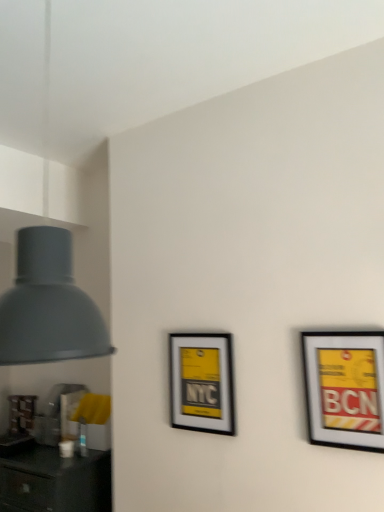
Measure the distance between matte gray lampshade at left and camera.

The distance of matte gray lampshade at left from camera is 27.06 inches.

Where is `matte black picture frame at right, which is the first picture frame in right-to-left order`? Image resolution: width=384 pixels, height=512 pixels. matte black picture frame at right, which is the first picture frame in right-to-left order is located at coordinates (345, 388).

Identify the location of matte black picture frame at center, which ranks as the first picture frame in back-to-front order. This screenshot has width=384, height=512. (202, 382).

Does matte black picture frame at center, the second picture frame positioned from the right, have a smaller size compared to matte gray lampshade at left?

Correct, matte black picture frame at center, the second picture frame positioned from the right, occupies less space than matte gray lampshade at left.

Is matte black picture frame at center, which ranks as the first picture frame in back-to-front order, oriented towards matte gray lampshade at left?

Yes, matte black picture frame at center, which ranks as the first picture frame in back-to-front order, is oriented towards matte gray lampshade at left.

Is there a large distance between matte black picture frame at center, which ranks as the 1th picture frame in left-to-right order, and matte gray lampshade at left?

Yes.

Is matte black picture frame at center, which ranks as the first picture frame in back-to-front order, inside or outside of matte gray lampshade at left?

matte black picture frame at center, which ranks as the first picture frame in back-to-front order, is not inside matte gray lampshade at left, it's outside.

Would you say matte black picture frame at center, which ranks as the 1th picture frame in left-to-right order, is inside or outside matte black picture frame at right, the 2th picture frame in the left-to-right sequence?

The correct answer is: outside.

Who is bigger, matte black picture frame at center, the second picture frame positioned from the right, or matte black picture frame at right, which is the first picture frame in right-to-left order?

With larger size is matte black picture frame at center, the second picture frame positioned from the right.

Which is behind, point (210, 387) or point (380, 406)?

Point (210, 387)

Could you measure the distance between matte black picture frame at right, which is the first picture frame in right-to-left order, and matte black picture frame at center, the second picture frame positioned from the right?

matte black picture frame at right, which is the first picture frame in right-to-left order, and matte black picture frame at center, the second picture frame positioned from the right, are 18.64 inches apart.

How many degrees apart are the facing directions of matte black picture frame at right, acting as the first picture frame starting from the front, and matte black picture frame at center, which ranks as the 1th picture frame in left-to-right order?

93 degrees.

Is matte black picture frame at right, acting as the first picture frame starting from the front, thinner than matte black picture frame at center, which ranks as the 1th picture frame in left-to-right order?

No.

Find the location of a particular element. The height and width of the screenshot is (512, 384). picture frame located above the matte black picture frame at right, acting as the second picture frame starting from the back (from a real-world perspective) is located at coordinates (202, 382).

Are matte gray lampshade at left and matte black picture frame at right, acting as the second picture frame starting from the back, far apart?

Absolutely, matte gray lampshade at left is distant from matte black picture frame at right, acting as the second picture frame starting from the back.

How many degrees apart are the facing directions of matte gray lampshade at left and matte black picture frame at right, acting as the second picture frame starting from the back?

The angular difference between matte gray lampshade at left and matte black picture frame at right, acting as the second picture frame starting from the back, is 59.4 degrees.

Does matte gray lampshade at left have a smaller size compared to matte black picture frame at right, acting as the second picture frame starting from the back?

Actually, matte gray lampshade at left might be larger than matte black picture frame at right, acting as the second picture frame starting from the back.

Is matte gray lampshade at left positioned before matte black picture frame at right, acting as the first picture frame starting from the front?

Yes.

Which point is more distant from viewer, (47, 13) or (221, 359)?

Point (221, 359)

Is matte gray lampshade at left smaller than matte black picture frame at center, the second picture frame positioned from the right?

Incorrect, matte gray lampshade at left is not smaller in size than matte black picture frame at center, the second picture frame positioned from the right.

Considering the positions of objects matte gray lampshade at left and matte black picture frame at center, which ranks as the 1th picture frame in left-to-right order, in the image provided, who is more to the right, matte gray lampshade at left or matte black picture frame at center, which ranks as the 1th picture frame in left-to-right order,?

matte black picture frame at center, which ranks as the 1th picture frame in left-to-right order, is more to the right.

From the image's perspective, who appears lower, matte gray lampshade at left or matte black picture frame at center, which ranks as the 1th picture frame in left-to-right order?

matte black picture frame at center, which ranks as the 1th picture frame in left-to-right order, from the image's perspective.

Which of these two, matte black picture frame at right, the 2th picture frame in the left-to-right sequence, or matte gray lampshade at left, stands taller?

Standing taller between the two is matte gray lampshade at left.

Can you confirm if matte black picture frame at right, acting as the first picture frame starting from the front, is bigger than matte gray lampshade at left?

No, matte black picture frame at right, acting as the first picture frame starting from the front, is not bigger than matte gray lampshade at left.

Can matte gray lampshade at left be found inside matte black picture frame at right, which is the first picture frame in right-to-left order?

No, matte gray lampshade at left is not a part of matte black picture frame at right, which is the first picture frame in right-to-left order.

Based on their positions, is matte black picture frame at right, acting as the first picture frame starting from the front, located to the left or right of matte gray lampshade at left?

In the image, matte black picture frame at right, acting as the first picture frame starting from the front, appears on the right side of matte gray lampshade at left.

Identify the location of picture frame that is the 2nd object located below the matte gray lampshade at left (from the image's perspective). (202, 382).

I want to click on picture frame that appears above the matte black picture frame at center, which ranks as the 1th picture frame in left-to-right order (from the image's perspective), so click(x=345, y=388).

Considering their positions, is matte black picture frame at center, which ranks as the 1th picture frame in left-to-right order, positioned closer to matte black picture frame at right, the 2th picture frame in the left-to-right sequence, than matte gray lampshade at left?

matte black picture frame at center, which ranks as the 1th picture frame in left-to-right order, lies closer to matte black picture frame at right, the 2th picture frame in the left-to-right sequence, than the other object.

From the image, which object appears to be nearer to matte black picture frame at center, the second picture frame positioned from the front, matte gray lampshade at left or matte black picture frame at right, the 2th picture frame in the left-to-right sequence?

matte black picture frame at right, the 2th picture frame in the left-to-right sequence, lies closer to matte black picture frame at center, the second picture frame positioned from the front, than the other object.

Considering their positions, is matte black picture frame at right, the 2th picture frame in the left-to-right sequence, positioned closer to matte gray lampshade at left than matte black picture frame at center, which ranks as the first picture frame in back-to-front order?

matte black picture frame at right, the 2th picture frame in the left-to-right sequence, is closer to matte gray lampshade at left.

Looking at the image, which one is located further to matte black picture frame at center, the second picture frame positioned from the front, matte black picture frame at right, acting as the second picture frame starting from the back, or matte gray lampshade at left?

matte gray lampshade at left is positioned further to the anchor matte black picture frame at center, the second picture frame positioned from the front.

Looking at the image, which one is located closer to matte gray lampshade at left, matte black picture frame at center, the second picture frame positioned from the front, or matte black picture frame at right, the 2th picture frame in the left-to-right sequence?

matte black picture frame at right, the 2th picture frame in the left-to-right sequence, is closer to matte gray lampshade at left.

Based on the photo, which object lies further to the anchor point matte black picture frame at right, which is the first picture frame in right-to-left order, matte gray lampshade at left or matte black picture frame at center, which ranks as the first picture frame in back-to-front order?

Based on the image, matte gray lampshade at left appears to be further to matte black picture frame at right, which is the first picture frame in right-to-left order.

At what (x,y) coordinates should I click in order to perform the action: click on picture frame between matte gray lampshade at left and matte black picture frame at center, which ranks as the 1th picture frame in left-to-right order, in the front-back direction. Please return your answer as a coordinate pair (x, y). This screenshot has width=384, height=512. Looking at the image, I should click on click(x=345, y=388).